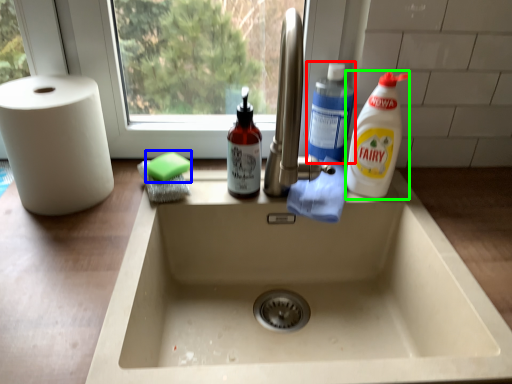
Question: Estimate the real-world distances between objects in this image. Which object is closer to cleaning product (highlighted by a red box), soap (highlighted by a blue box) or cleaning product (highlighted by a green box)?

Choices:
 (A) soap
 (B) cleaning product

Answer: (B)